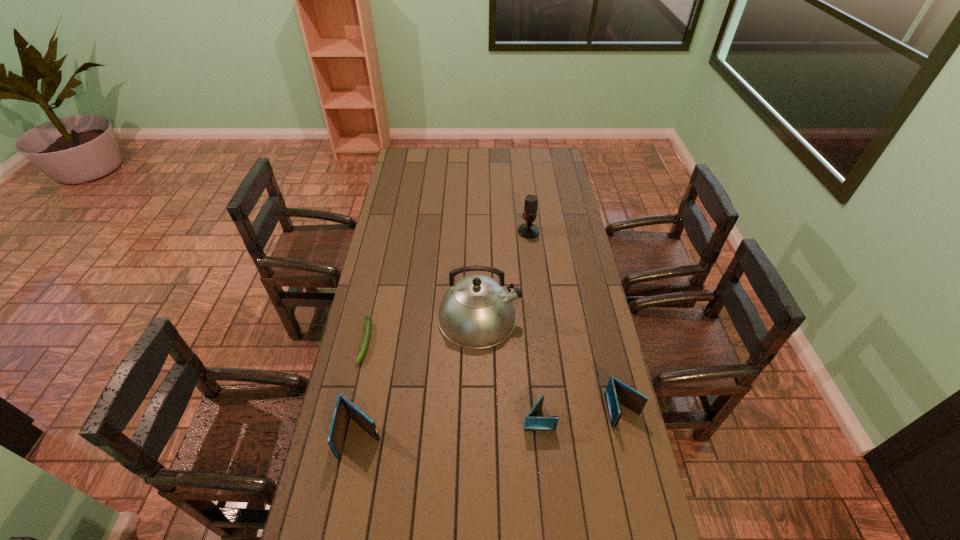
Where is `vacant position in the image that satisfies the following two spatial constraints: 1. on the side of the fifth shortest object with the red ring; 2. on the front-facing side of the zucchini`? The height and width of the screenshot is (540, 960). vacant position in the image that satisfies the following two spatial constraints: 1. on the side of the fifth shortest object with the red ring; 2. on the front-facing side of the zucchini is located at coordinates (541, 342).

The height and width of the screenshot is (540, 960). Identify the location of free point that satisfies the following two spatial constraints: 1. on the side of the microphone with the red ring; 2. on the front-facing side of the zucchini. (541, 342).

The width and height of the screenshot is (960, 540). In order to click on vacant region that satisfies the following two spatial constraints: 1. from the spout of the tallest object; 2. on the exterior surface of the third tallest object in this screenshot , I will do `click(479, 436)`.

You are a GUI agent. You are given a task and a screenshot of the screen. Output one action in this format:
    pyautogui.click(x=<x>, y=<y>)
    Task: Click on the blank space that satisfies the following two spatial constraints: 1. on the side of the farthest object with the red ring; 2. on the front-facing side of the zucchini
    Image resolution: width=960 pixels, height=540 pixels.
    Given the screenshot: What is the action you would take?
    pyautogui.click(x=541, y=342)